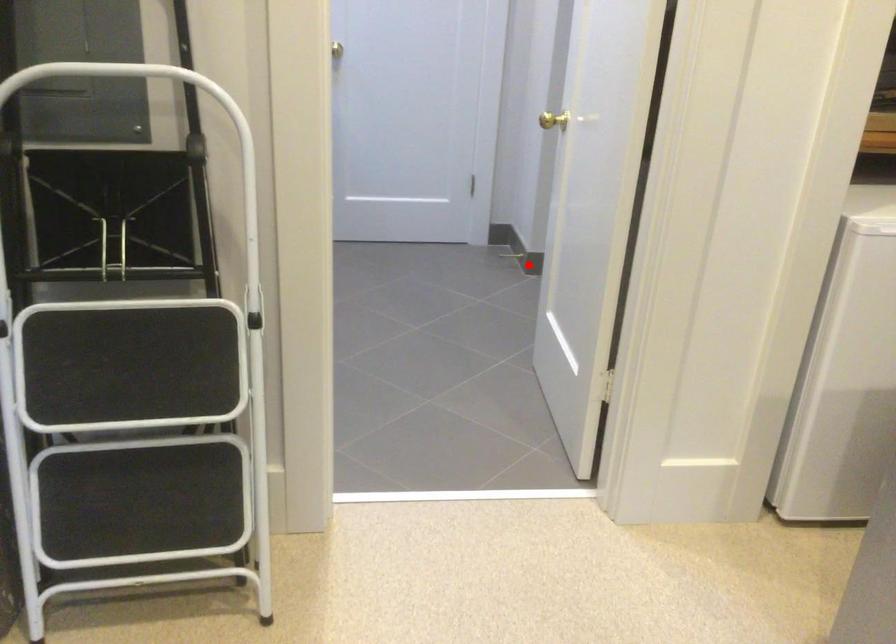
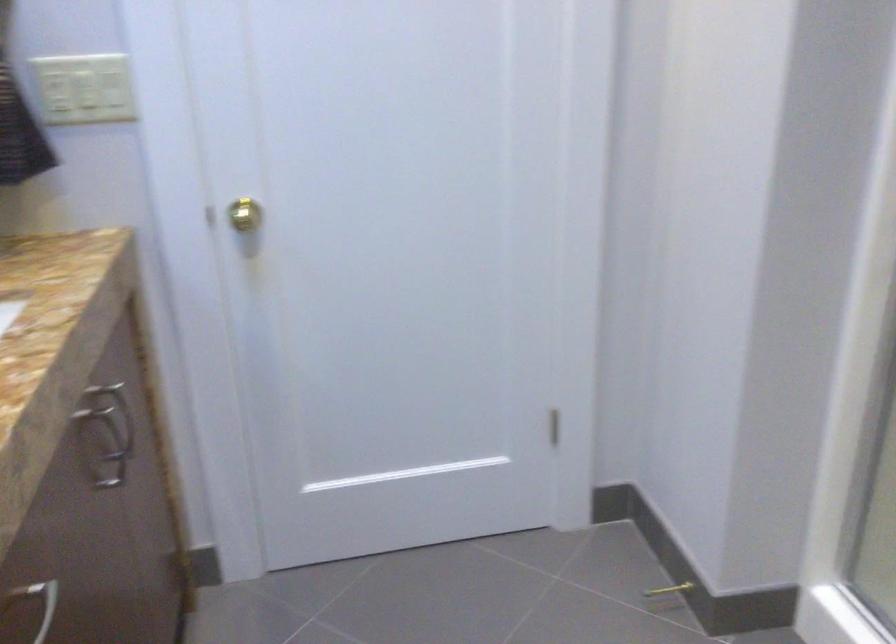
Question: I am providing you with two images of the same scene from different viewpoints. A red point is shown in image1. For the corresponding object point in image2, is it positioned nearer or farther from the camera?

Choices:
 (A) Nearer
 (B) Farther

Answer: (A)